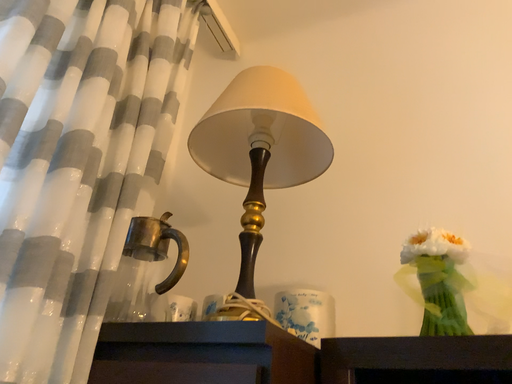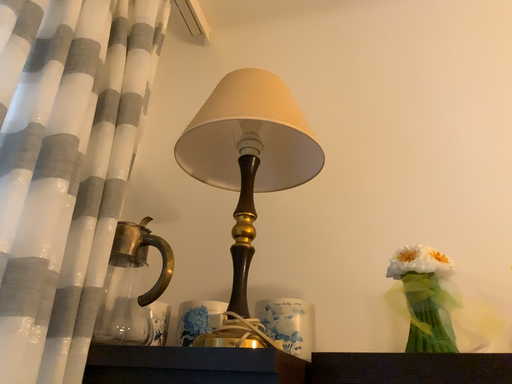
Question: How did the camera likely rotate when shooting the video?

Choices:
 (A) rotated right
 (B) rotated left

Answer: (A)